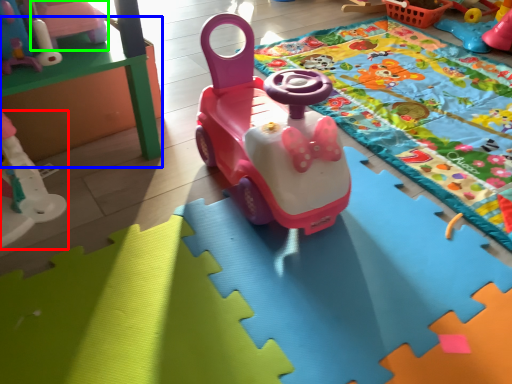
Question: Based on their relative distances, which object is farther from toy (highlighted by a red box)? Choose from table (highlighted by a blue box) and toy (highlighted by a green box).

Choices:
 (A) table
 (B) toy

Answer: (B)